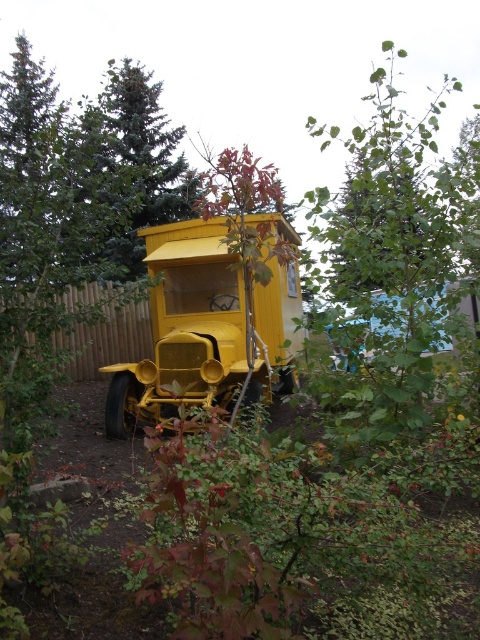
Question: Which of the following is the closest to the observer?

Choices:
 (A) (91, 234)
 (B) (111, 339)

Answer: (A)

Question: Among these points, which one is farthest from the camera?

Choices:
 (A) (269, 378)
 (B) (108, 83)
 (C) (73, 372)

Answer: (B)

Question: Is green leafy tree at upper center closer to camera compared to matte yellow car at center?

Choices:
 (A) no
 (B) yes

Answer: (B)

Question: Which object is closer to the camera taking this photo?

Choices:
 (A) green textured tree at upper left
 (B) green leafy tree at upper center
 (C) matte yellow car at center

Answer: (B)

Question: Is green leafy tree at upper center thinner than matte yellow car at center?

Choices:
 (A) no
 (B) yes

Answer: (A)

Question: Does matte yellow car at center come in front of green textured tree at upper left?

Choices:
 (A) yes
 (B) no

Answer: (B)